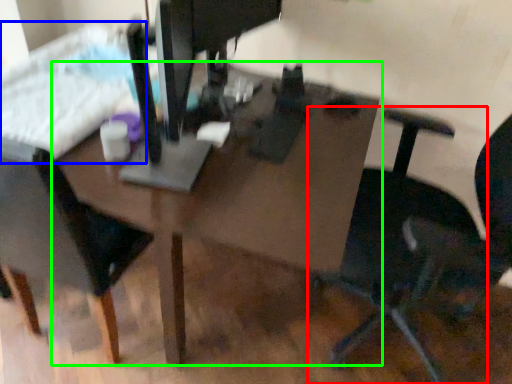
Question: Based on their relative distances, which object is farther from chair (highlighted by a red box)? Choose from bed (highlighted by a blue box) and table (highlighted by a green box).

Choices:
 (A) bed
 (B) table

Answer: (A)